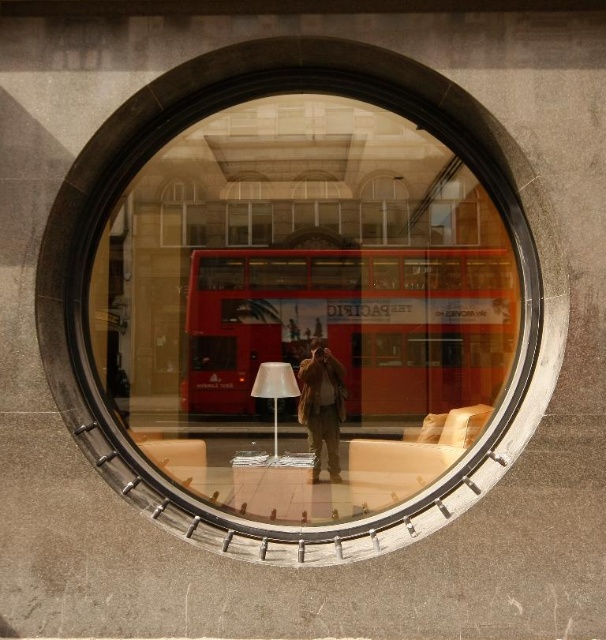
Question: Can you confirm if red matte bus at center is wider than brown leather jacket at center?

Choices:
 (A) yes
 (B) no

Answer: (A)

Question: Can you confirm if red matte bus at center is positioned to the right of brown leather jacket at center?

Choices:
 (A) yes
 (B) no

Answer: (A)

Question: Which object appears farthest from the camera in this image?

Choices:
 (A) transparent glass window at center
 (B) red matte bus at center

Answer: (B)

Question: Which point appears closest to the camera in this image?

Choices:
 (A) (238, 371)
 (B) (115, 161)
 (C) (261, 372)
 (D) (298, 374)

Answer: (B)

Question: Estimate the real-world distances between objects in this image. Which object is farther from the transparent glass window at center?

Choices:
 (A) brown leather jacket at center
 (B) white matte lamp at center
 (C) red matte bus at center

Answer: (C)

Question: Is transparent glass window at center bigger than brown leather jacket at center?

Choices:
 (A) no
 (B) yes

Answer: (B)